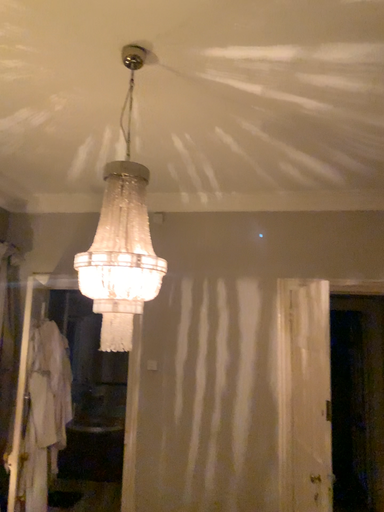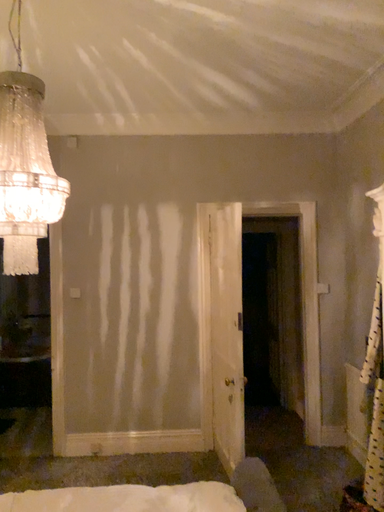
Question: How did the camera likely rotate when shooting the video?

Choices:
 (A) rotated right
 (B) rotated left

Answer: (A)